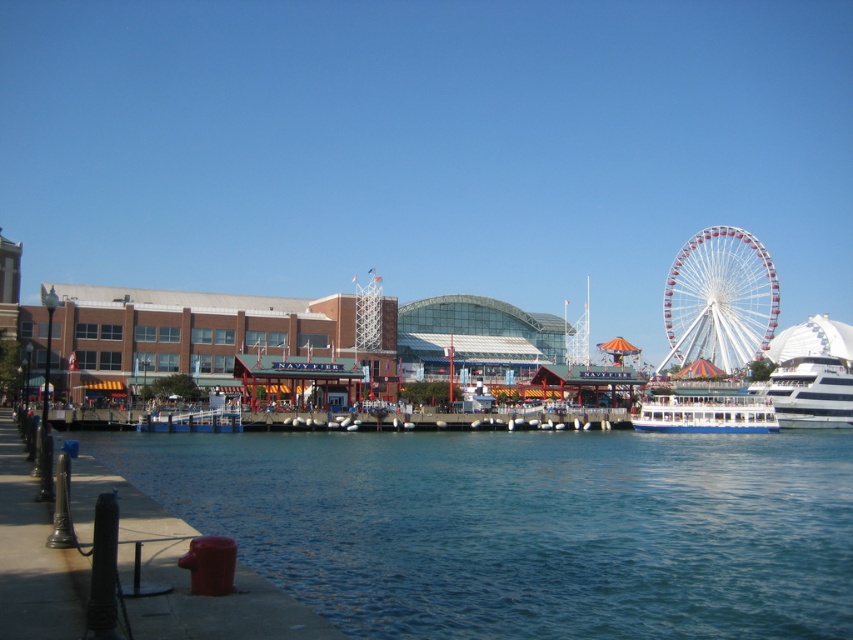
Who is positioned more to the right, clear blue water at lower center or white glossy boat at lower center?

white glossy boat at lower center is more to the right.

Is point (558, 570) less distant than point (727, 412)?

Yes, it is.

Is point (666, 452) positioned behind point (705, 419)?

That is False.

The image size is (853, 640). I want to click on clear blue water at lower center, so click(x=524, y=525).

Between white metallic ferris wheel at right and white glossy yacht at right, which one has less height?

With less height is white glossy yacht at right.

Which is below, white metallic ferris wheel at right or white glossy yacht at right?

white glossy yacht at right

In order to click on white metallic ferris wheel at right in this screenshot , I will do `click(718, 300)`.

In order to click on white metallic ferris wheel at right in this screenshot , I will do [x=718, y=300].

Who is taller, clear blue water at lower center or white metallic ferris wheel at right?

white metallic ferris wheel at right

Where is `clear blue water at lower center`? This screenshot has height=640, width=853. clear blue water at lower center is located at coordinates (524, 525).